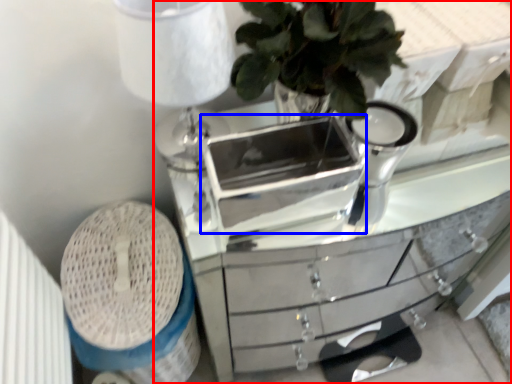
Question: Which of the following is the farthest to the observer, chest of drawers (highlighted by a red box) or appliance (highlighted by a blue box)?

Choices:
 (A) chest of drawers
 (B) appliance

Answer: (A)